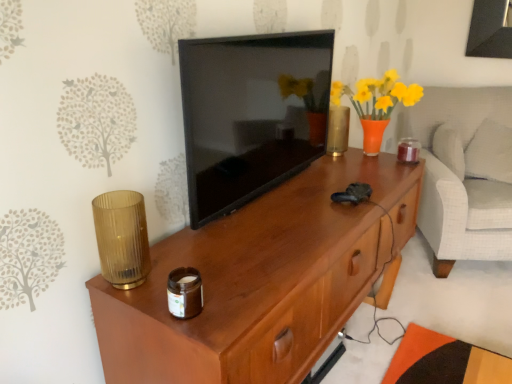
Find the location of a particular element. vacant region to the right of black glossy tv at center is located at coordinates (317, 184).